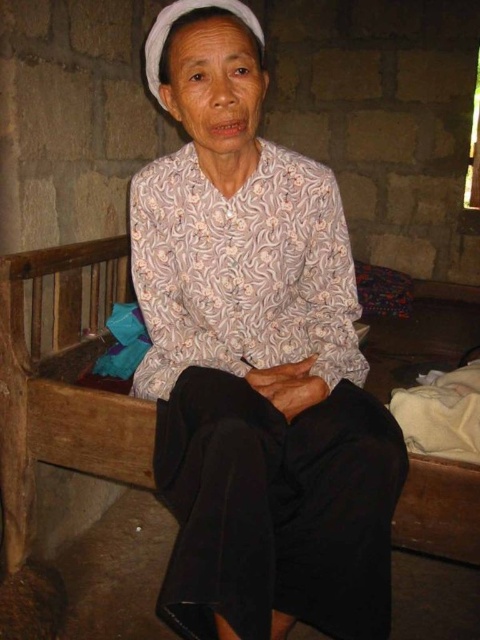
You are an interior designer planning to place a new lamp between the white printed blouse at center and the wooden bench at center. Which object should the lamp be closer to if it needs to be placed closer to the object that is nearer to you?

The white printed blouse at center is closer to the viewer than the wooden bench at center, so the lamp should be placed closer to the white printed blouse at center.

Based on the photo, you are an interior designer observing the scene. You need to place a decorative vase between the white printed blouse at center and the wooden bench at center. Where should you position the vase?

The white printed blouse at center is to the right of the wooden bench at center, so the vase should be placed between them, to the right of the wooden bench at center and to the left of the white printed blouse at center.

Consider the image. You are an interior designer planning to place a new decorative item on the wooden bench at center. Considering the size of the white printed blouse at center currently on the bench, will the new item fit without overcrowding the space?

The white printed blouse at center is smaller than the wooden bench at center, so there should be enough space to add a new decorative item without overcrowding the space.